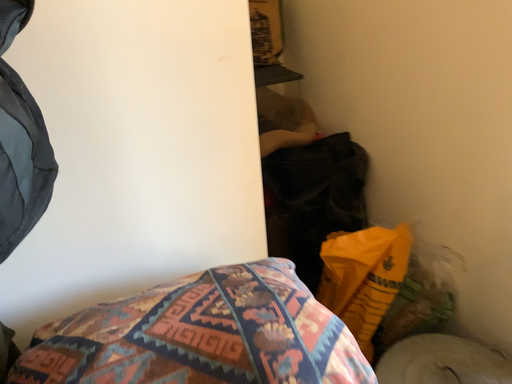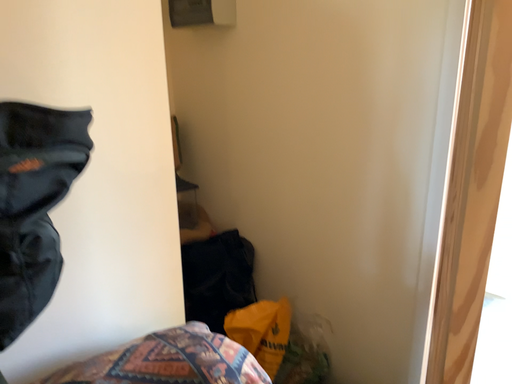
Question: Which way did the camera rotate in the video?

Choices:
 (A) rotated downward
 (B) rotated upward

Answer: (B)